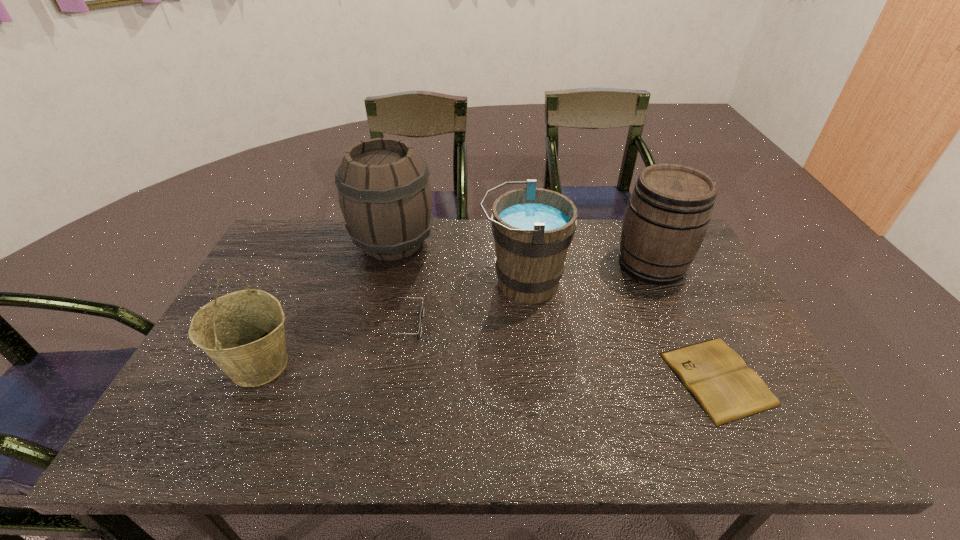
Identify the location of vacant space located 0.150m with a handle on the side of the third object from right to left. (430, 283).

What are the coordinates of `free space located 0.210m with a handle on the side of the third object from right to left` in the screenshot? It's located at (410, 283).

I want to click on vacant space situated 0.350m on the back of the leftmost wine bucket, so point(312,254).

Find the location of a particular element. The height and width of the screenshot is (540, 960). vacant space located 0.330m on the front-facing side of the sunglasses is located at coordinates pyautogui.click(x=544, y=323).

The image size is (960, 540). Find the location of `free space located on the left of the book`. free space located on the left of the book is located at coordinates (564, 379).

The image size is (960, 540). In order to click on object that is at the near edge in this screenshot , I will do `click(718, 378)`.

Locate an element on the screen. This screenshot has width=960, height=540. object located at the left edge is located at coordinates (242, 332).

The image size is (960, 540). Find the location of `wine bucket located in the right edge section of the desktop`. wine bucket located in the right edge section of the desktop is located at coordinates (669, 211).

This screenshot has width=960, height=540. What are the coordinates of `book that is at the right edge` in the screenshot? It's located at (718, 378).

This screenshot has height=540, width=960. Find the location of `object at the far right corner`. object at the far right corner is located at coordinates (669, 211).